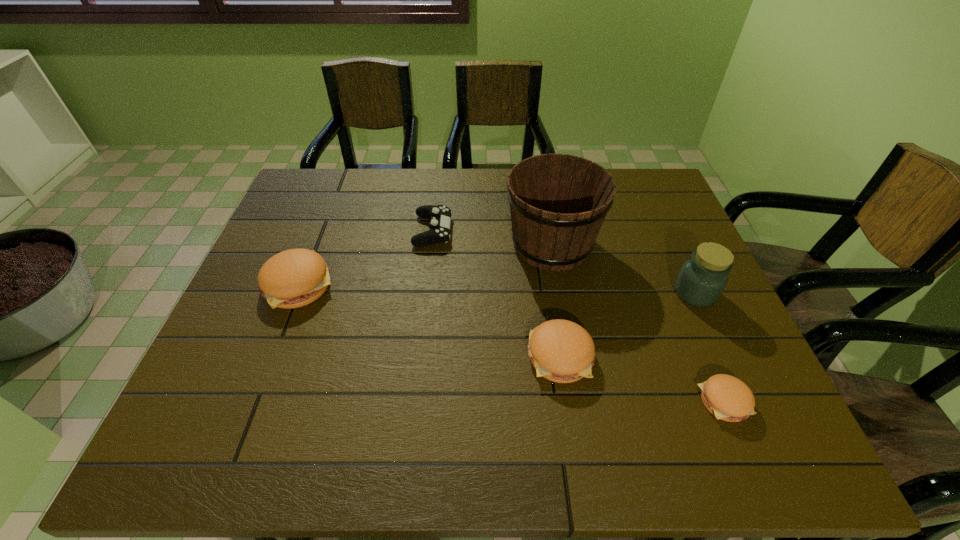
Where is `vacant position at the left edge of the desktop`? vacant position at the left edge of the desktop is located at coordinates (222, 354).

In order to click on vacant space at the right edge of the desktop in this screenshot , I will do click(665, 227).

You are a GUI agent. You are given a task and a screenshot of the screen. Output one action in this format:
    pyautogui.click(x=<x>, y=<y>)
    Task: Click on the blank area at the far left corner
    
    Given the screenshot: What is the action you would take?
    pyautogui.click(x=343, y=176)

I want to click on vacant space at the near left corner of the desktop, so click(x=240, y=372).

Where is `free space between the farthest patty and the second shortest object`? This screenshot has width=960, height=540. free space between the farthest patty and the second shortest object is located at coordinates (366, 258).

Where is `free spot between the leftmost object and the tallest object`? The width and height of the screenshot is (960, 540). free spot between the leftmost object and the tallest object is located at coordinates (425, 264).

At what (x,y) coordinates should I click in order to perform the action: click on empty space between the fifth shortest object and the second shortest patty. Please return your answer as a coordinate pair (x, y). This screenshot has width=960, height=540. Looking at the image, I should click on (628, 325).

Image resolution: width=960 pixels, height=540 pixels. I want to click on vacant space that's between the tallest object and the rightmost patty, so click(x=637, y=323).

Find the location of a particular element. This screenshot has height=540, width=960. free space between the shortest object and the jar is located at coordinates (709, 347).

The image size is (960, 540). In order to click on free point between the farthest patty and the control in this screenshot , I will do `click(366, 258)`.